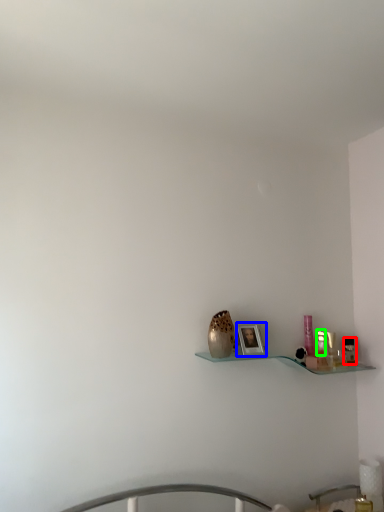
Question: Which is farther away from toiletry (highlighted by a red box)? picture frame (highlighted by a blue box) or toiletry (highlighted by a green box)?

Choices:
 (A) picture frame
 (B) toiletry

Answer: (A)